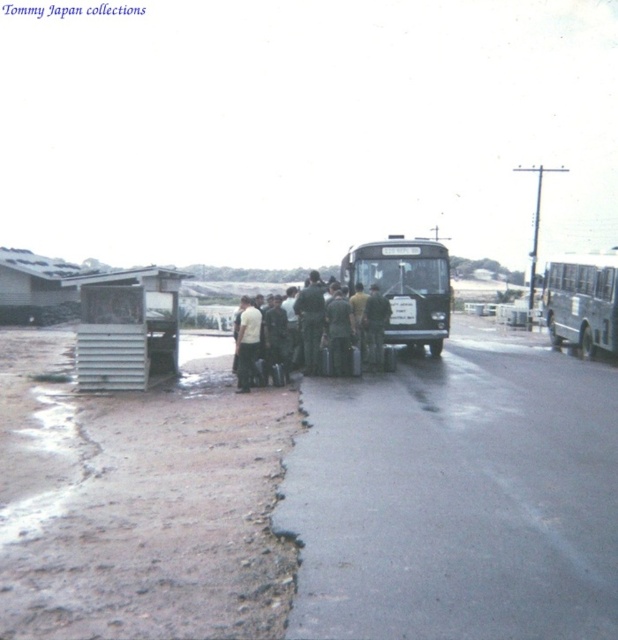
Question: Among these objects, which one is farthest from the camera?

Choices:
 (A) green fabric uniform at center
 (B) black matte bus at center
 (C) metallic gray bus stop at left

Answer: (B)

Question: Is green matte bus at right above light yellow shirt at center?

Choices:
 (A) yes
 (B) no

Answer: (A)

Question: Can you confirm if black matte bus at center is positioned to the left of green matte bus at right?

Choices:
 (A) no
 (B) yes

Answer: (B)

Question: Which object is closer to the camera taking this photo?

Choices:
 (A) black matte bus at center
 (B) light yellow shirt at center
 (C) metallic gray bus stop at left
 (D) green matte uniform at center

Answer: (C)

Question: Can you confirm if green matte uniform at center is smaller than green fabric uniform at center?

Choices:
 (A) yes
 (B) no

Answer: (B)

Question: Estimate the real-world distances between objects in this image. Which object is farther from the metallic gray bus stop at left?

Choices:
 (A) light yellow shirt at center
 (B) green matte bus at right

Answer: (B)